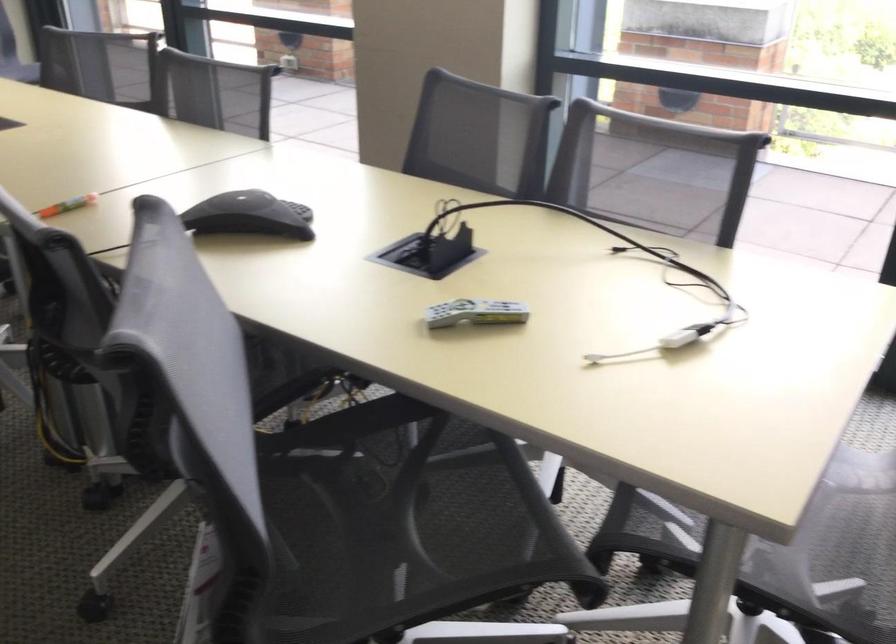
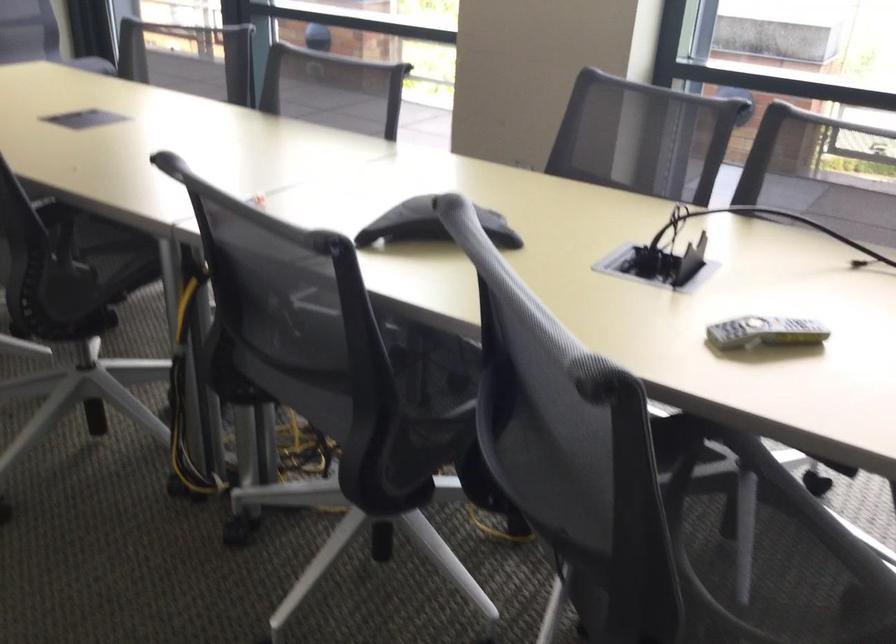
The point at (444, 469) is marked in the first image. Where is the corresponding point in the second image?

(735, 507)